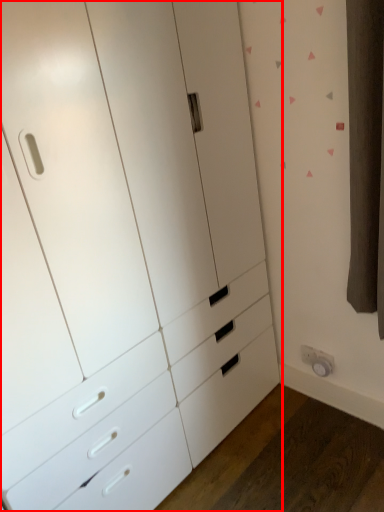
Question: From the image, what is the correct spatial relationship of chest of drawers (annotated by the red box) in relation to electric outlet?

Choices:
 (A) left
 (B) right

Answer: (A)